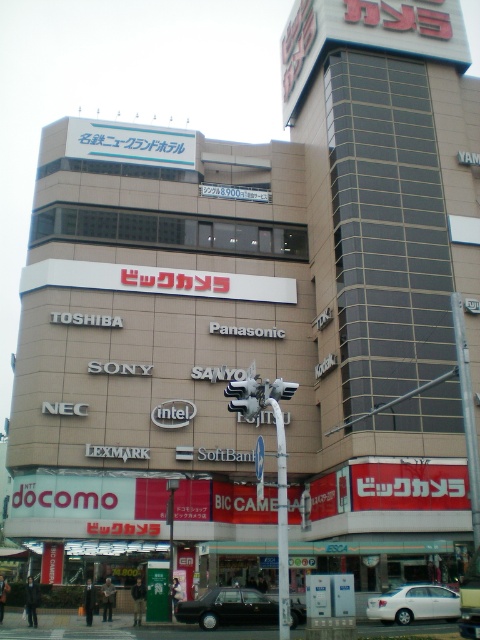
Is black glossy car at center below white matte car at lower center?

Correct, black glossy car at center is located below white matte car at lower center.

Is point (210, 628) closer to camera compared to point (407, 605)?

No, it is behind (407, 605).

The height and width of the screenshot is (640, 480). I want to click on black glossy car at center, so click(228, 609).